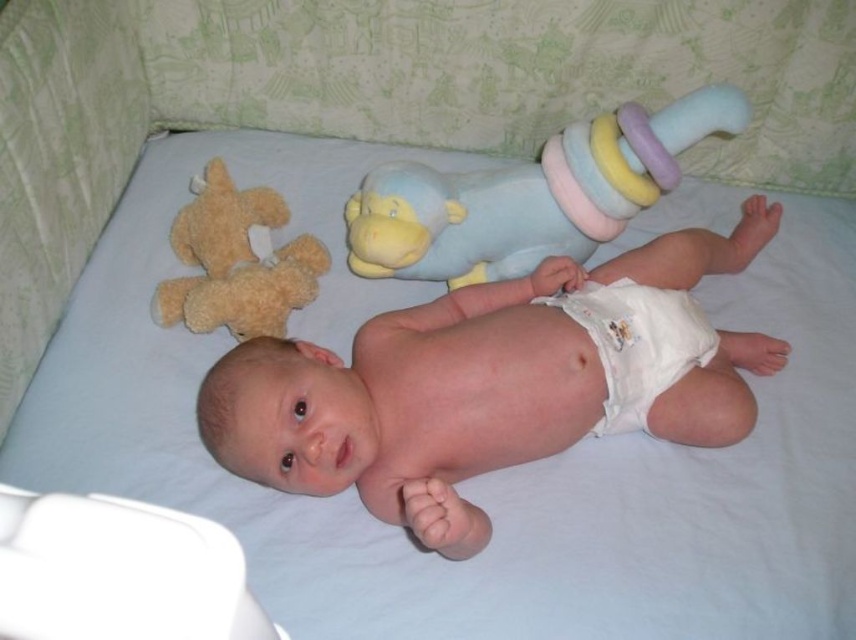
Is pink cloth diaper at center to the left of white cloth diaper at center from the viewer's perspective?

Correct, you'll find pink cloth diaper at center to the left of white cloth diaper at center.

Is point (286, 394) closer to viewer compared to point (584, 320)?

Yes, point (286, 394) is in front of point (584, 320).

Measure the distance between point (480, 529) and camera.

They are 36.86 inches apart.

Locate an element on the screen. pink cloth diaper at center is located at coordinates (443, 387).

Between soft brown teddy bear at upper left and white cloth diaper at center, which one has more height?

With more height is soft brown teddy bear at upper left.

Between soft brown teddy bear at upper left and white cloth diaper at center, which one is positioned higher?

soft brown teddy bear at upper left

Is point (189, 221) positioned in front of point (615, 339)?

That is False.

This screenshot has width=856, height=640. Find the location of `soft brown teddy bear at upper left`. soft brown teddy bear at upper left is located at coordinates (236, 260).

Does point (373, 497) come in front of point (201, 312)?

Yes.

Who is more forward, (711, 433) or (204, 241)?

Point (711, 433) is more forward.

Where is `pink cloth diaper at center`? The width and height of the screenshot is (856, 640). pink cloth diaper at center is located at coordinates (443, 387).